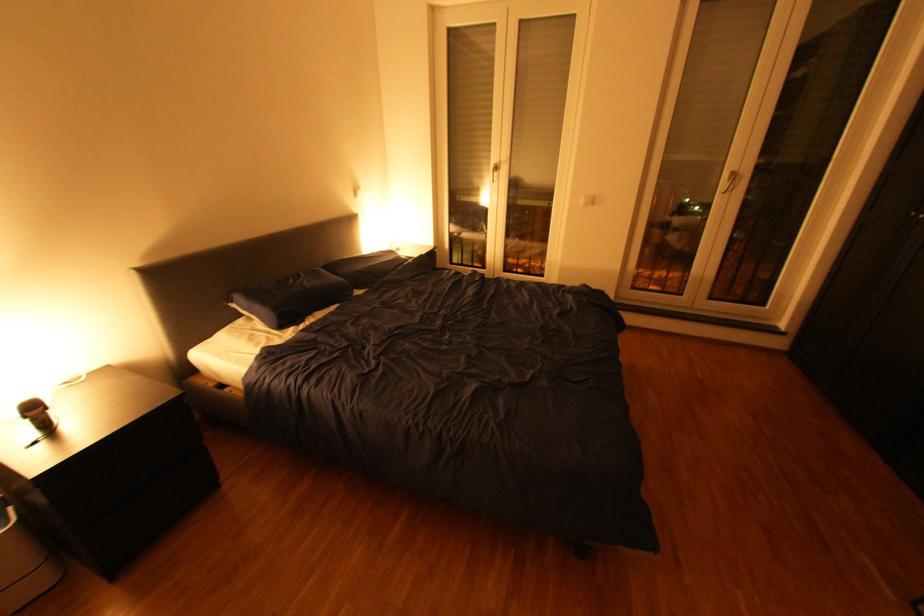
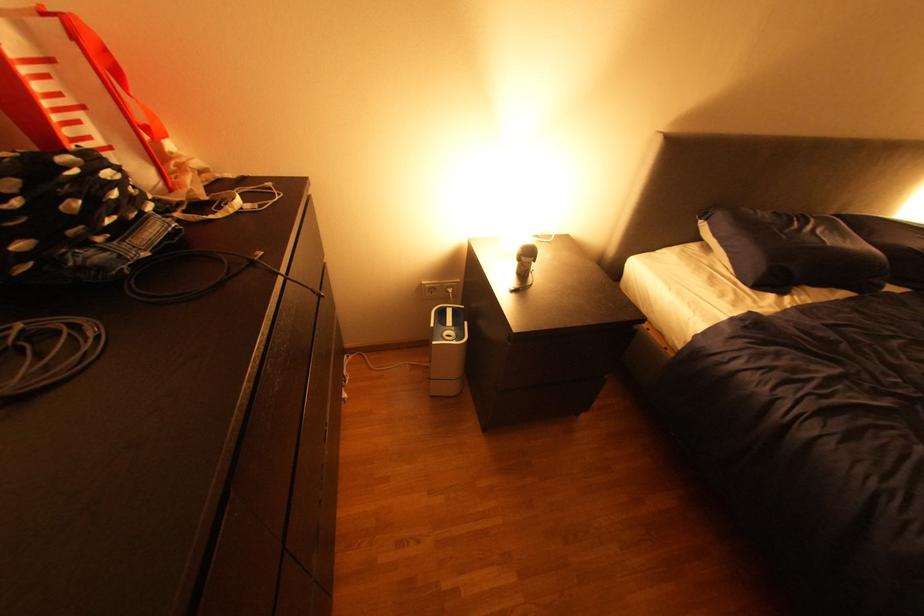
The first image is from the beginning of the video and the second image is from the end. How did the camera likely rotate when shooting the video?

The rotation direction of the camera is left-down.